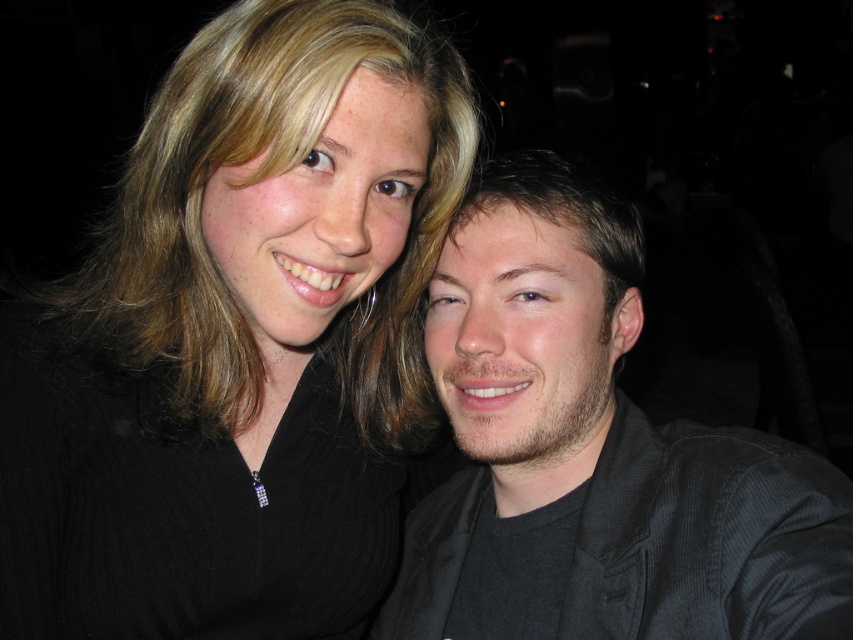
Who is more distant from viewer, (138, 484) or (584, 458)?

Positioned behind is point (584, 458).

What do you see at coordinates (239, 342) in the screenshot? The image size is (853, 640). I see `matte black hair at upper left` at bounding box center [239, 342].

Is point (393, 444) behind point (796, 528)?

Yes, point (393, 444) is farther from viewer.

I want to click on matte black hair at upper left, so click(x=239, y=342).